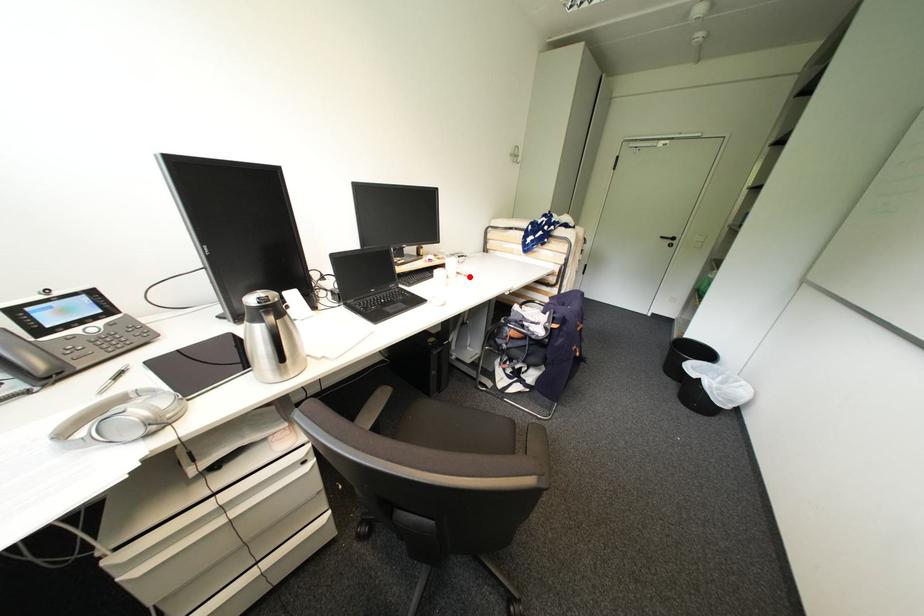
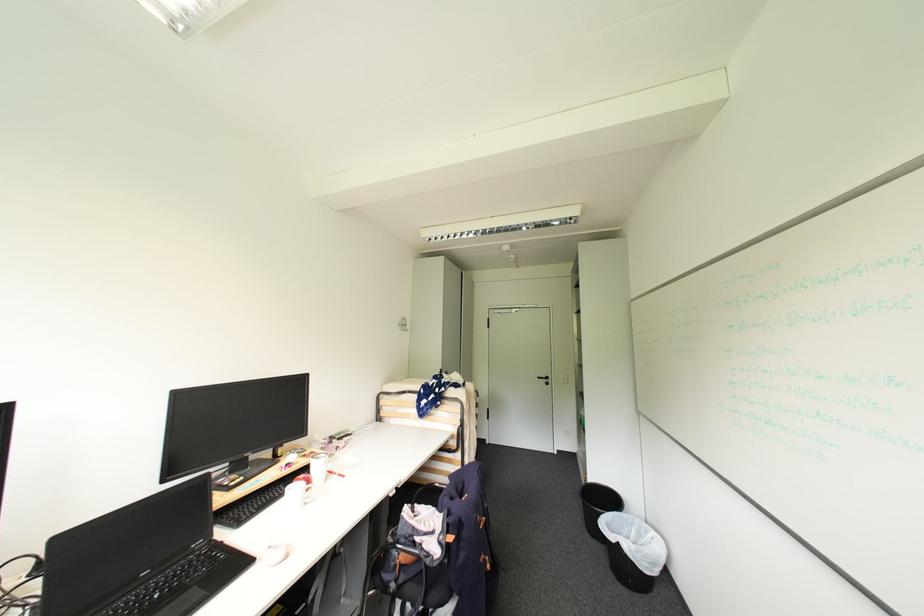
Find the pixel in the second image that matches the highlighted location in the first image.

(343, 477)